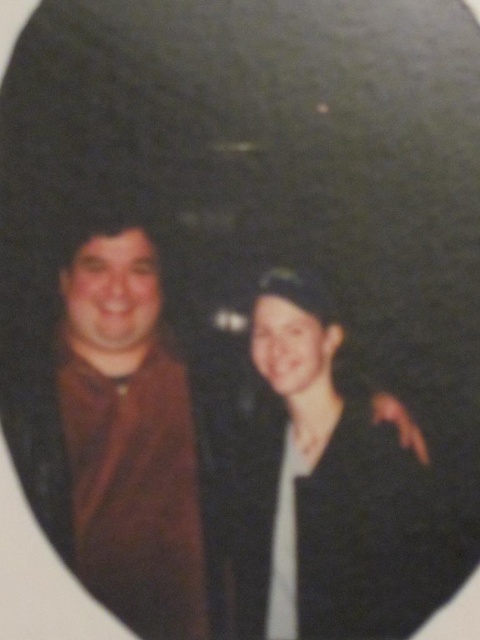
Does matte black jacket at center appear under brown matte shirt at left?

Indeed, matte black jacket at center is positioned under brown matte shirt at left.

Is point (282, 573) in front of point (123, 218)?

Yes, point (282, 573) is closer to viewer.

Where is `matte black jacket at center`? The height and width of the screenshot is (640, 480). matte black jacket at center is located at coordinates (325, 486).

In the scene shown: Does brown fabric couple at center come behind matte black jacket at center?

Yes, brown fabric couple at center is further from the viewer.

Does brown fabric couple at center appear on the right side of matte black jacket at center?

Incorrect, brown fabric couple at center is not on the right side of matte black jacket at center.

Who is more forward, (225, 403) or (370, 444)?

Positioned in front is point (370, 444).

Locate an element on the screen. The height and width of the screenshot is (640, 480). brown fabric couple at center is located at coordinates (144, 444).

Where is `brown fabric couple at center`? Image resolution: width=480 pixels, height=640 pixels. brown fabric couple at center is located at coordinates (144, 444).

Does brown fabric couple at center appear on the left side of brown matte shirt at left?

Incorrect, brown fabric couple at center is not on the left side of brown matte shirt at left.

Is point (168, 522) less distant than point (191, 513)?

Yes, point (168, 522) is closer to viewer.

Image resolution: width=480 pixels, height=640 pixels. In order to click on brown fabric couple at center in this screenshot , I will do `click(144, 444)`.